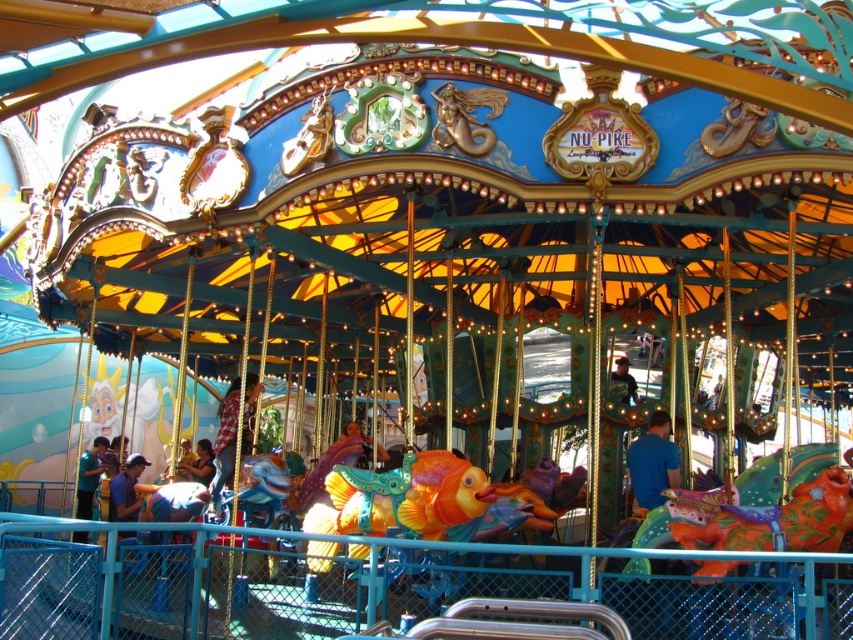
You are a visitor at the carousel. You notice the shiny orange horse at center and the plaid shirt at center. Which object is positioned lower from the ground?

The shiny orange horse at center is positioned lower from the ground than the plaid shirt at center because it is below it.

You are standing in front of the carousel at the amusement park. You see a blue matte shirt at center and a blue fabric shirt at lower left. Which shirt is located to the right of the other?

The blue matte shirt at center is positioned on the right side of blue fabric shirt at lower left, so the blue matte shirt at center is to the right of the blue fabric shirt at lower left.

You are standing in front of the carousel and want to take a photo of both the shiny orange horse at center and the plaid shirt at center. Which object should you focus on first to ensure both are in the frame?

You should focus on the shiny orange horse at center first because it is closer to you than the plaid shirt at center, so adjusting the camera to include it will also capture the plaid shirt at center which is further back.